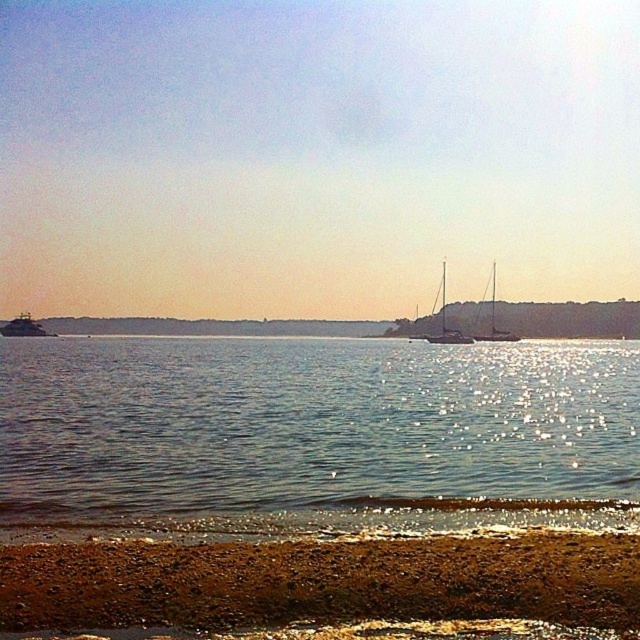
Does metallic silver boat at left have a smaller size compared to white matte sailboat at right?

Yes.

Who is lower down, metallic silver boat at left or white matte sailboat at right?

Positioned lower is metallic silver boat at left.

Is point (33, 326) behind point (518, 337)?

That is False.

This screenshot has width=640, height=640. I want to click on metallic silver boat at left, so (24, 326).

Who is shorter, white matte sailboat at center or white matte sailboat at right?

white matte sailboat at center

Find the location of a particular element. This screenshot has height=640, width=640. white matte sailboat at center is located at coordinates (445, 323).

Which is in front, point (435, 560) or point (497, 339)?

Point (435, 560) is in front.

Is the position of brown gravelly sand at lower center more distant than that of white matte sailboat at right?

No, brown gravelly sand at lower center is in front of white matte sailboat at right.

Locate an element on the screen. The width and height of the screenshot is (640, 640). brown gravelly sand at lower center is located at coordinates (321, 580).